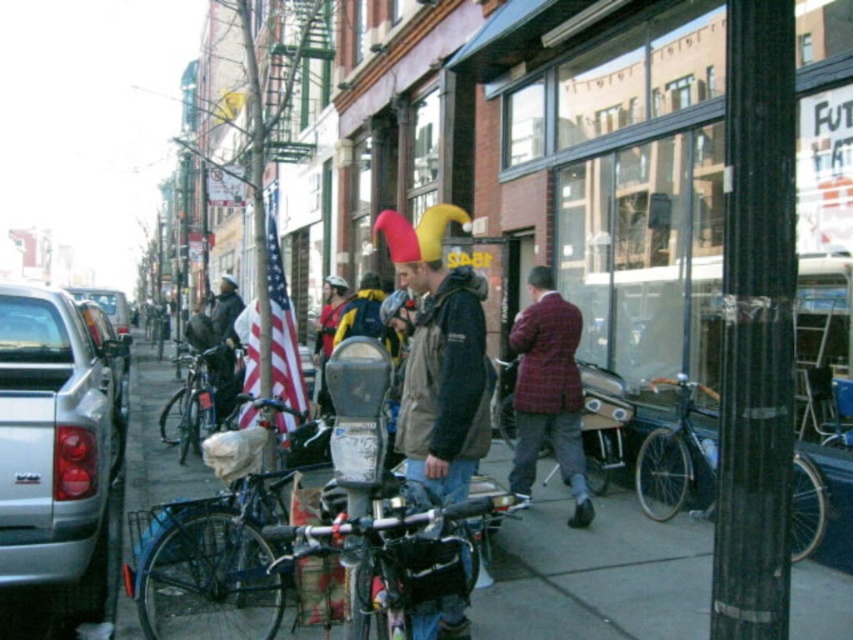
You are a delivery person who needs to place a package on the smooth concrete sidewalk at center. The package is 10 feet long. Can you place the package entirely on the sidewalk without overlapping the american flag at center?

The distance between the smooth concrete sidewalk at center and the american flag at center is 8.72 feet. Since the package is 10 feet long, it would extend beyond the 8.72 feet gap, overlapping the american flag at center. Therefore, you cannot place the package entirely on the sidewalk without overlapping the flag.

You are a city planner assessing the street layout. You need to ensure that the metallic silver bicycle at center can be seen from the nearby pedestrian crossing. Given the american flag at center is in front of it, does the flag block the view of the bicycle?

The american flag at center is taller than metallic silver bicycle at center, so it may block the view of the bicycle from certain angles depending on their positions.

You are a delivery person trying to navigate through the sidewalk. The smooth concrete sidewalk at center is below the american flag at center. Can you walk between them?

The smooth concrete sidewalk at center is below the american flag at center, so yes, you can walk between them since the sidewalk is under the flag and there is space in between.